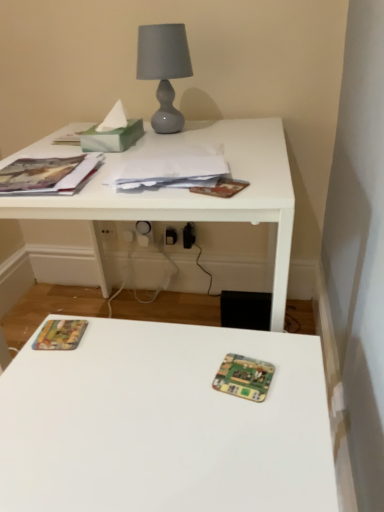
Identify the location of vacant space situated above white glossy table at upper center (from a real-world perspective). The height and width of the screenshot is (512, 384). (177, 145).